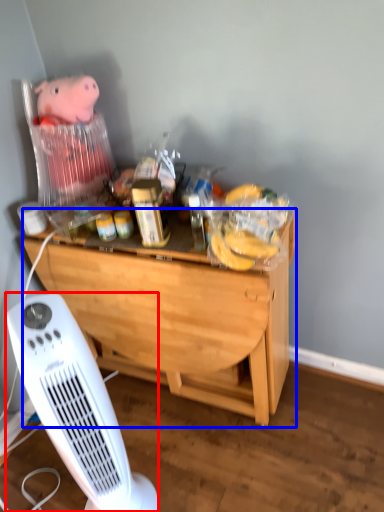
Question: Which object appears closest to the camera in this image, home appliance (highlighted by a red box) or desk (highlighted by a blue box)?

Choices:
 (A) home appliance
 (B) desk

Answer: (A)